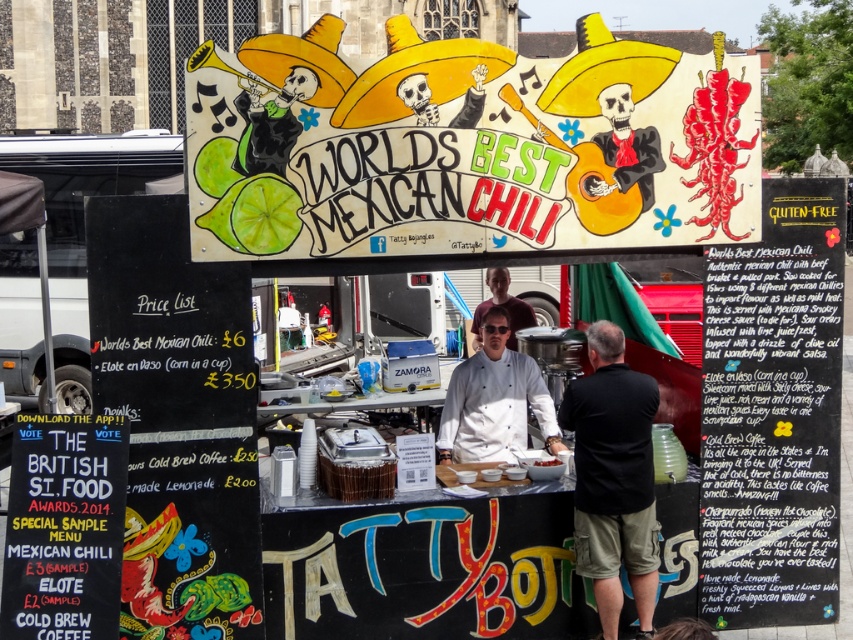
Question: Which of these objects is positioned farthest from the matte white chef coat at center?

Choices:
 (A) black cotton shirt at center
 (B) matte white bowl at center

Answer: (A)

Question: Does glittery blackboard at right appear under matte white bowl at center?

Choices:
 (A) yes
 (B) no

Answer: (B)

Question: Which point is farther from the camera taking this photo?

Choices:
 (A) [544, 465]
 (B) [715, 544]
 (C) [450, 428]
 (D) [473, 342]

Answer: (D)

Question: Is glittery blackboard at right positioned in front of matte white bowl at center?

Choices:
 (A) yes
 (B) no

Answer: (A)

Question: Does black cotton shirt at center have a greater width compared to matte white chef coat at center?

Choices:
 (A) no
 (B) yes

Answer: (A)

Question: Which point is closer to the camera taking this photo?

Choices:
 (A) (788, 289)
 (B) (576, 476)

Answer: (A)